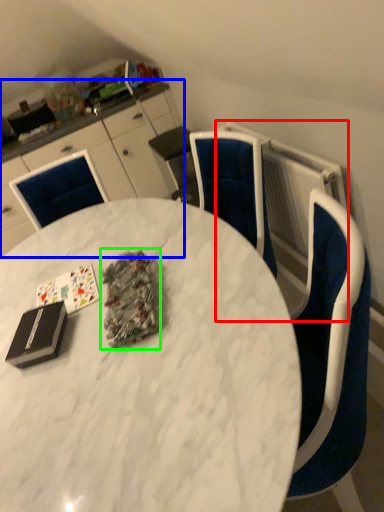
Question: Considering the real-world distances, which object is farthest from radiator (highlighted by a red box)? cabinetry (highlighted by a blue box) or debris (highlighted by a green box)?

Choices:
 (A) cabinetry
 (B) debris

Answer: (A)